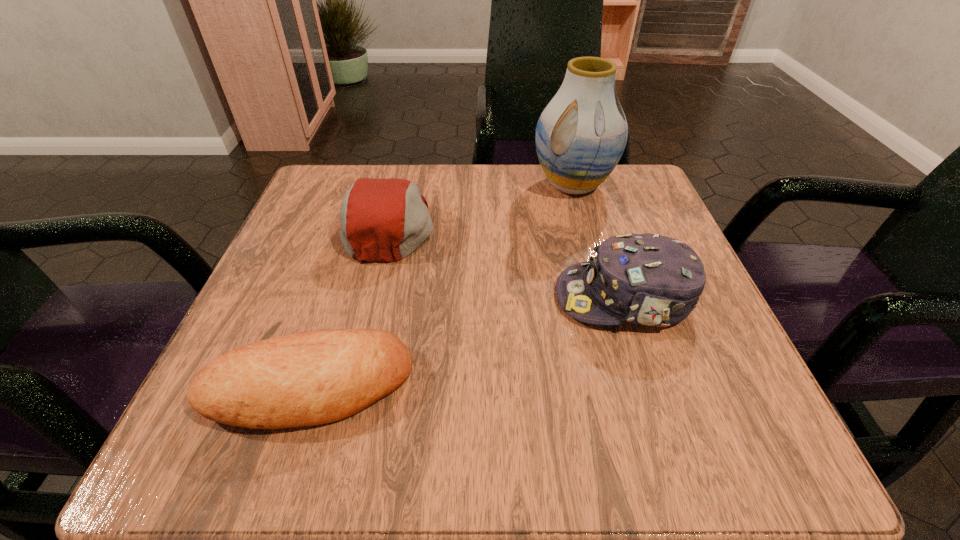
I want to click on vase, so click(x=581, y=134).

Identify the location of the left headwear. (385, 220).

Where is `the right headwear`? the right headwear is located at coordinates (x=647, y=279).

Locate an element on the screen. bread is located at coordinates (309, 378).

You are a GUI agent. You are given a task and a screenshot of the screen. Output one action in this format:
    pyautogui.click(x=<x>, y=<y>)
    Task: Click on the shortest object
    The height and width of the screenshot is (540, 960).
    Given the screenshot: What is the action you would take?
    pyautogui.click(x=309, y=378)

Where is `free space located on the left of the tallest object`? free space located on the left of the tallest object is located at coordinates (476, 185).

Where is `vacant space situated 0.210m on the front-facing side of the left headwear`? The width and height of the screenshot is (960, 540). vacant space situated 0.210m on the front-facing side of the left headwear is located at coordinates (543, 226).

Identify the location of vacant space located 0.150m on the front-facing side of the right headwear. (464, 298).

Identify the location of vacant region located on the front-facing side of the right headwear. (513, 298).

You are a GUI agent. You are given a task and a screenshot of the screen. Output one action in this format:
    pyautogui.click(x=<x>, y=<y>)
    Task: Click on the vacant space situated on the front-facing side of the right headwear
    
    Given the screenshot: What is the action you would take?
    pyautogui.click(x=402, y=298)